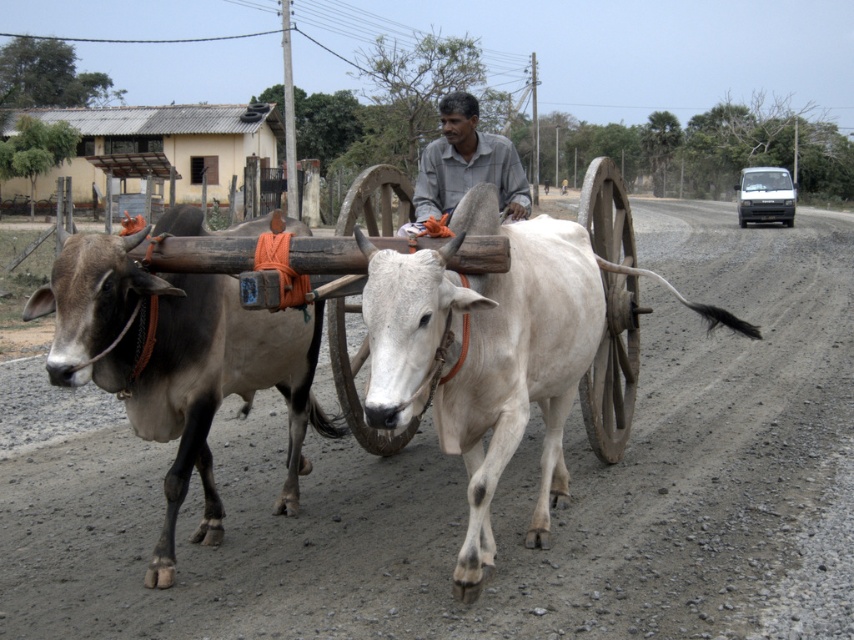
You are a traveler standing on the gray gravel road at center and want to board the wooden cart at center. Which direction should you move to reach the cart?

The gray gravel road at center is to the right of wooden cart at center, so you should move to your left to reach the cart.